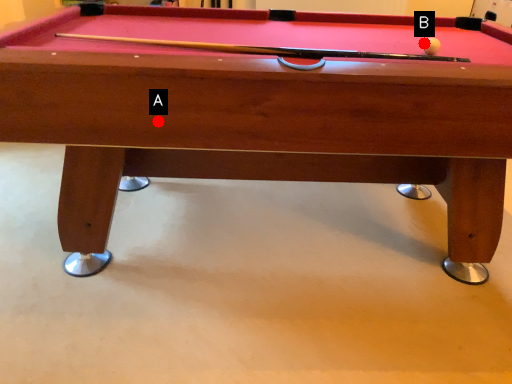
Question: Two points are circled on the image, labeled by A and B beside each circle. Which of the following is the farthest from the observer?

Choices:
 (A) A is further
 (B) B is further

Answer: (B)